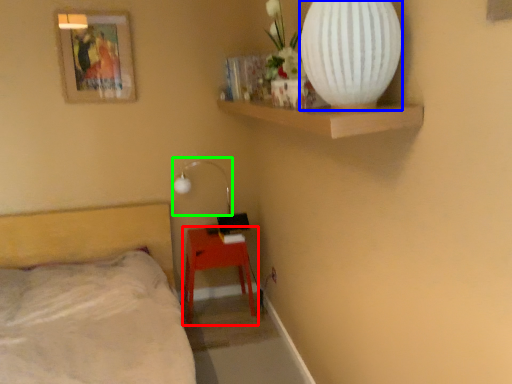
Question: Estimate the real-world distances between objects in this image. Which object is farther from nightstand (highlighted by a red box), vase (highlighted by a blue box) or lamp (highlighted by a green box)?

Choices:
 (A) vase
 (B) lamp

Answer: (A)